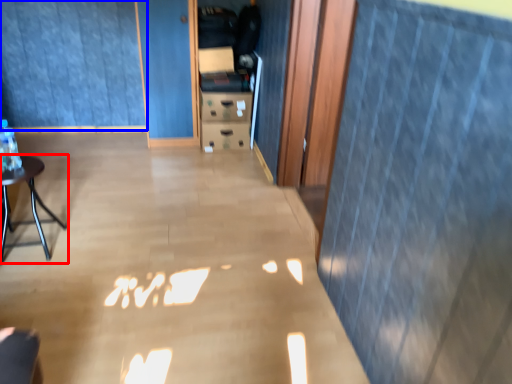
Question: Which of the following is the farthest to the observer, furniture (highlighted by a red box) or curtain (highlighted by a blue box)?

Choices:
 (A) furniture
 (B) curtain

Answer: (B)